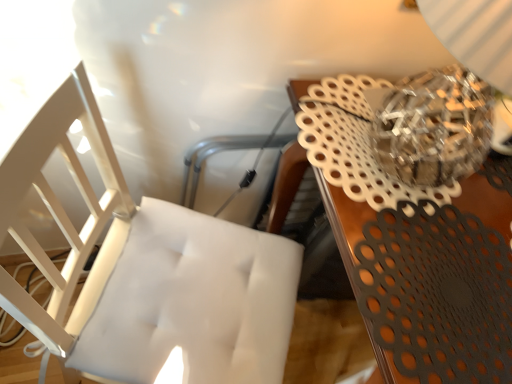
Locate an element on the screen. The height and width of the screenshot is (384, 512). metallic brown table at upper right is located at coordinates (414, 252).

In order to face metallic brown table at upper right, should I rotate leftwards or rightwards?

Rotate your view right by about 18.675°.

What do you see at coordinates (414, 252) in the screenshot? I see `metallic brown table at upper right` at bounding box center [414, 252].

What do you see at coordinates (143, 269) in the screenshot?
I see `white tufted cushion at left` at bounding box center [143, 269].

This screenshot has height=384, width=512. I want to click on white tufted cushion at left, so click(x=143, y=269).

This screenshot has height=384, width=512. In order to click on metallic brown table at upper right in this screenshot , I will do `click(414, 252)`.

Considering the positions of objects white tufted cushion at left and metallic brown table at upper right in the image provided, who is more to the left, white tufted cushion at left or metallic brown table at upper right?

From the viewer's perspective, white tufted cushion at left appears more on the left side.

Which object is more forward, white tufted cushion at left or metallic brown table at upper right?

white tufted cushion at left is in front.

Is point (154, 307) more distant than point (486, 361)?

Yes, point (154, 307) is farther from viewer.

From the image's perspective, is white tufted cushion at left over metallic brown table at upper right?

No.

From a real-world perspective, which object rests below the other?

metallic brown table at upper right is physically lower.

Can you confirm if white tufted cushion at left is wider than metallic brown table at upper right?

In fact, white tufted cushion at left might be narrower than metallic brown table at upper right.

In terms of height, does white tufted cushion at left look taller or shorter compared to metallic brown table at upper right?

white tufted cushion at left is taller than metallic brown table at upper right.

Between white tufted cushion at left and metallic brown table at upper right, which one has smaller size?

Smaller between the two is white tufted cushion at left.

Is white tufted cushion at left spatially inside metallic brown table at upper right, or outside of it?

white tufted cushion at left cannot be found inside metallic brown table at upper right.

Consider the image. Is there a large distance between white tufted cushion at left and metallic brown table at upper right?

No, white tufted cushion at left is not far away from metallic brown table at upper right.

Is white tufted cushion at left oriented towards metallic brown table at upper right?

Yes, white tufted cushion at left faces towards metallic brown table at upper right.

How different are the orientations of white tufted cushion at left and metallic brown table at upper right in degrees?

The angle between the facing direction of white tufted cushion at left and the facing direction of metallic brown table at upper right is 65.1 degrees.

Where is `chair below the metallic brown table at upper right (from the image's perspective)`? The image size is (512, 384). chair below the metallic brown table at upper right (from the image's perspective) is located at coordinates (143, 269).

Is metallic brown table at upper right to the right of white tufted cushion at left from the viewer's perspective?

Yes, metallic brown table at upper right is to the right of white tufted cushion at left.

Considering their positions, is metallic brown table at upper right located in front of or behind white tufted cushion at left?

metallic brown table at upper right is behind white tufted cushion at left.

Is point (408, 292) in front of point (177, 268)?

Yes, point (408, 292) is in front of point (177, 268).

From the image's perspective, does metallic brown table at upper right appear higher than white tufted cushion at left?

Indeed, from the image's perspective, metallic brown table at upper right is shown above white tufted cushion at left.

From a real-world perspective, between metallic brown table at upper right and white tufted cushion at left, who is vertically lower?

metallic brown table at upper right is physically lower.

Considering the relative sizes of metallic brown table at upper right and white tufted cushion at left in the image provided, is metallic brown table at upper right wider than white tufted cushion at left?

Indeed, metallic brown table at upper right has a greater width compared to white tufted cushion at left.

Between metallic brown table at upper right and white tufted cushion at left, which one has more height?

white tufted cushion at left is taller.

Which of these two, metallic brown table at upper right or white tufted cushion at left, is smaller?

With smaller size is white tufted cushion at left.

Do you think metallic brown table at upper right is within white tufted cushion at left, or outside of it?

metallic brown table at upper right exists outside the volume of white tufted cushion at left.

Is metallic brown table at upper right not near white tufted cushion at left?

metallic brown table at upper right is near white tufted cushion at left, not far away.

Is white tufted cushion at left at the back of metallic brown table at upper right?

No, metallic brown table at upper right is not facing away from white tufted cushion at left.

Can you tell me how much metallic brown table at upper right and white tufted cushion at left differ in facing direction?

The angular difference between metallic brown table at upper right and white tufted cushion at left is 65.1 degrees.

How much distance is there between metallic brown table at upper right and white tufted cushion at left?

They are 14.45 inches apart.

Image resolution: width=512 pixels, height=384 pixels. What are the coordinates of `chair above the metallic brown table at upper right (from a real-world perspective)` in the screenshot? It's located at (143, 269).

Identify the location of table above the white tufted cushion at left (from the image's perspective). (414, 252).

Locate an element on the screen. chair above the metallic brown table at upper right (from a real-world perspective) is located at coordinates (143, 269).